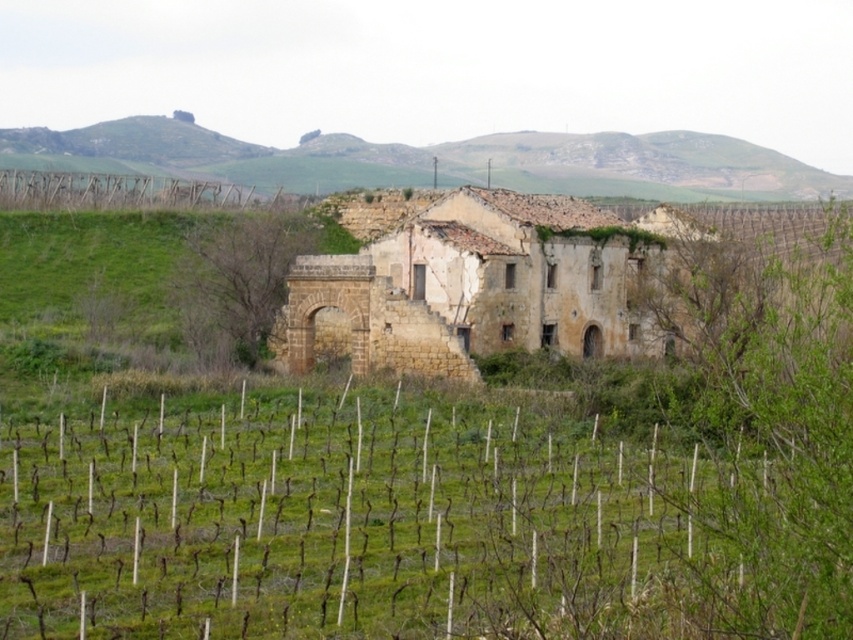
You are a farmer inspecting the vineyard and notice the brown grass at center and the green grassy hillside at upper center. Which area has a larger coverage in the scene?

The green grassy hillside at upper center has a larger coverage than the brown grass at center.